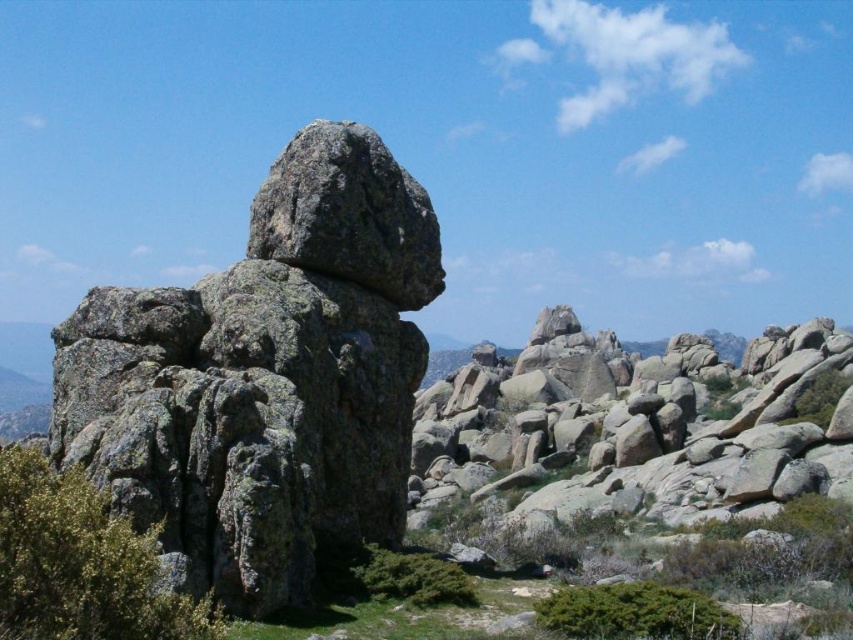
Is rough granite rock at center to the right of granite rock at center from the viewer's perspective?

Incorrect, rough granite rock at center is not on the right side of granite rock at center.

Find the location of a particular element. The height and width of the screenshot is (640, 853). rough granite rock at center is located at coordinates (265, 378).

Locate an element on the screen. This screenshot has width=853, height=640. rough granite rock at center is located at coordinates 265,378.

Does point (212, 458) come closer to viewer compared to point (577, 332)?

Yes, point (212, 458) is in front of point (577, 332).

Is point (253, 589) closer to viewer compared to point (531, 525)?

Yes, point (253, 589) is closer to viewer.

Locate an element on the screen. rough granite rock at center is located at coordinates (265, 378).

Is gray rough rock at center taller than granite rock at center?

Yes, gray rough rock at center is taller than granite rock at center.

Can you confirm if gray rough rock at center is bigger than granite rock at center?

Correct, gray rough rock at center is larger in size than granite rock at center.

Locate an element on the screen. The image size is (853, 640). gray rough rock at center is located at coordinates (634, 428).

Identify the location of gray rough rock at center. The width and height of the screenshot is (853, 640). (634, 428).